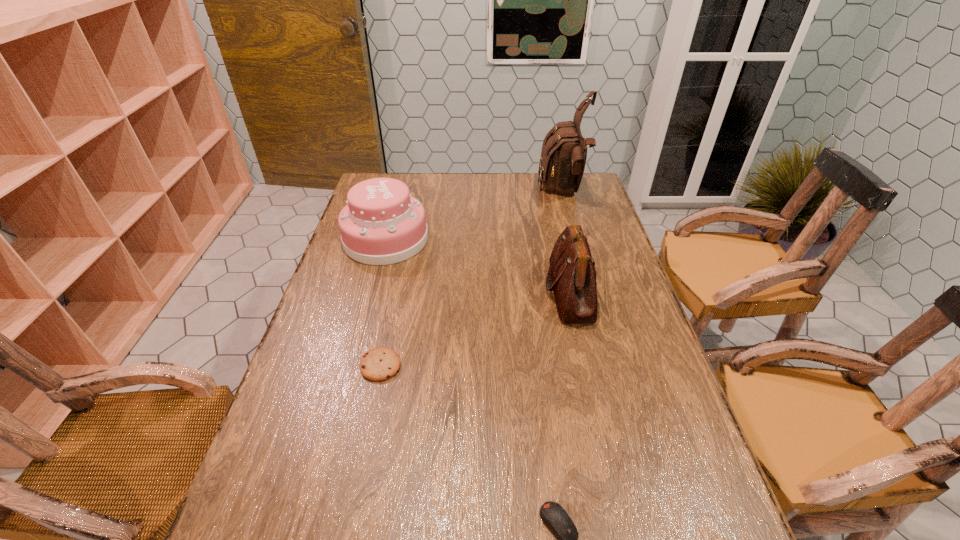
Locate an element on the screen. This screenshot has height=540, width=960. the farthest object is located at coordinates (564, 151).

The image size is (960, 540). Find the location of `the tallest object`. the tallest object is located at coordinates (564, 151).

Locate an element on the screen. the shorter shoulder bag is located at coordinates 571,276.

Find the location of a particular element. birthday cake is located at coordinates (382, 224).

The width and height of the screenshot is (960, 540). Identify the location of cookie. (379, 364).

You are a GUI agent. You are given a task and a screenshot of the screen. Output one action in this format:
    pyautogui.click(x=<x>, y=<y>)
    Task: Click on the vacant space located 0.360m on the front-facing side of the taller shoulder bag
    
    Given the screenshot: What is the action you would take?
    pyautogui.click(x=447, y=192)

Locate an element on the screen. The width and height of the screenshot is (960, 540). free space located on the front-facing side of the taller shoulder bag is located at coordinates (472, 192).

Image resolution: width=960 pixels, height=540 pixels. I want to click on free space located on the front-facing side of the taller shoulder bag, so click(465, 192).

Locate an element on the screen. This screenshot has width=960, height=540. vacant space located on the front of the nearer shoulder bag is located at coordinates (584, 352).

The height and width of the screenshot is (540, 960). What are the coordinates of `free space located 0.130m on the front of the birthday cake` in the screenshot? It's located at (372, 294).